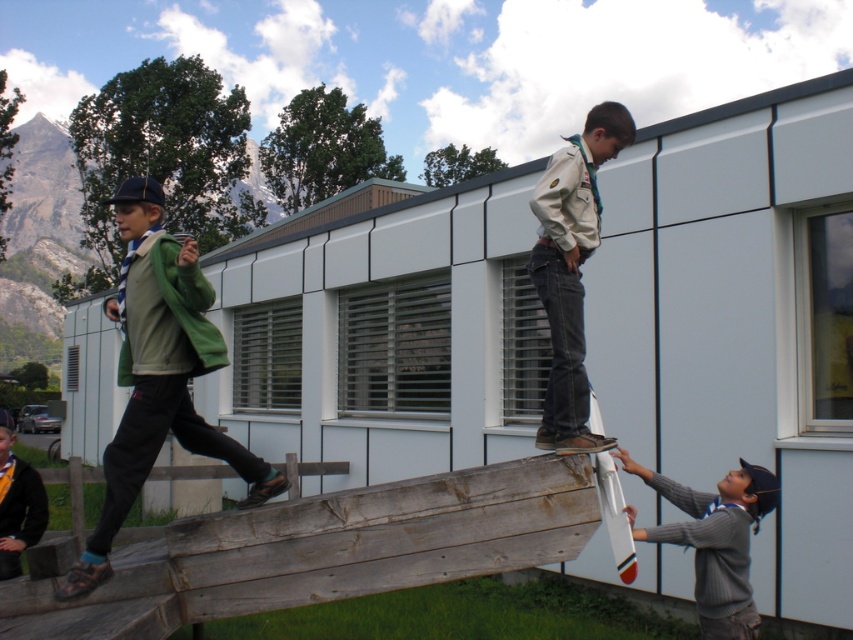
What is the 2D coordinate of the denim jeans at upper center in the image?

The 2D coordinate of the denim jeans at upper center is at point [572,269].

You are standing at the point labeled as point (563, 161) and want to walk to the point labeled as point (180, 396). Which direction should you face to move directly towards your destination?

You should face the direction towards the point labeled as point (180, 396), which is in front of point (563, 161).

You are a photographer trying to capture a photo of both the denim jeans at upper center and the gray knitted sweater at lower right in the same frame. Based on their positions, which one should you adjust your camera to focus on first to ensure both are in the shot?

The denim jeans at upper center is positioned on the left side of gray knitted sweater at lower right, so you should focus on the gray knitted sweater at lower right first to ensure both are included in the frame.